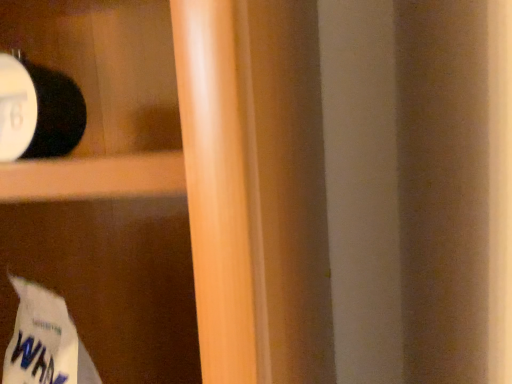
Image resolution: width=512 pixels, height=384 pixels. What do you see at coordinates (45, 341) in the screenshot?
I see `white paper grocery bag at lower left` at bounding box center [45, 341].

Where is `white paper grocery bag at lower left`? white paper grocery bag at lower left is located at coordinates (45, 341).

This screenshot has height=384, width=512. What are the coordinates of `white paper grocery bag at lower left` in the screenshot? It's located at (45, 341).